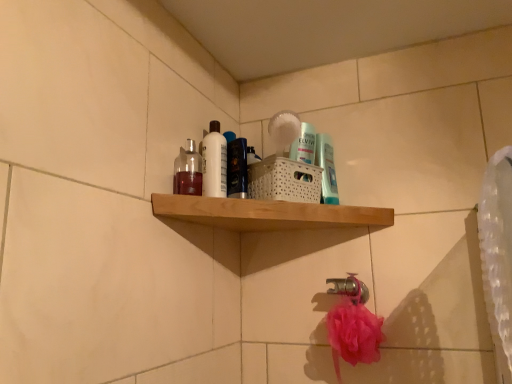
Question: Is white glossy bottle at upper center inside or outside of silver metallic faucet at lower center?

Choices:
 (A) inside
 (B) outside

Answer: (B)

Question: Considering the positions of white glossy bottle at upper center and silver metallic faucet at lower center in the image, is white glossy bottle at upper center wider or thinner than silver metallic faucet at lower center?

Choices:
 (A) wide
 (B) thin

Answer: (B)

Question: Which object is positioned closest to the white glossy bottle at upper center?

Choices:
 (A) translucent glass bottle at upper left, the 1th mouthwash positioned from the left
 (B) silver metallic faucet at lower center
 (C) wooden shelf at upper center
 (D) shiny blue bottle at center
 (E) translucent plastic mouthwash at upper center, the first mouthwash viewed from the right

Answer: (D)

Question: Which of these objects is positioned closest to the wooden shelf at upper center?

Choices:
 (A) translucent glass bottle at upper left, the 1th mouthwash positioned from the left
 (B) shiny blue bottle at center
 (C) translucent plastic mouthwash at upper center, which is the first mouthwash from back to front
 (D) white glossy bottle at upper center
 (E) silver metallic faucet at lower center

Answer: (B)